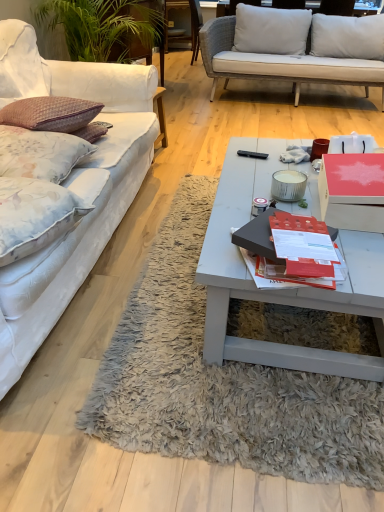
Question: Should I look upward or downward to see wooden chair at upper center?

Choices:
 (A) down
 (B) up

Answer: (B)

Question: Are matte black book at center and white fabric couch at left located far from each other?

Choices:
 (A) no
 (B) yes

Answer: (A)

Question: Is matte black book at center oriented away from white fabric couch at left?

Choices:
 (A) yes
 (B) no

Answer: (B)

Question: Considering the relative positions of matte black book at center and white fabric couch at left in the image provided, is matte black book at center to the left of white fabric couch at left from the viewer's perspective?

Choices:
 (A) yes
 (B) no

Answer: (B)

Question: Is the position of matte black book at center more distant than that of white fabric couch at left?

Choices:
 (A) no
 (B) yes

Answer: (B)

Question: Is matte black book at center shorter than white fabric couch at left?

Choices:
 (A) no
 (B) yes

Answer: (B)

Question: From the image's perspective, is matte black book at center beneath white fabric couch at left?

Choices:
 (A) yes
 (B) no

Answer: (A)

Question: Does red cardboard box at center have a greater height compared to floral fabric pillow at left, which appears as the 2th pillow when viewed from the front?

Choices:
 (A) yes
 (B) no

Answer: (B)

Question: Are red cardboard box at center and floral fabric pillow at left, the first pillow from the back, making contact?

Choices:
 (A) no
 (B) yes

Answer: (A)

Question: Can you confirm if red cardboard box at center is smaller than floral fabric pillow at left, the first pillow from the back?

Choices:
 (A) yes
 (B) no

Answer: (A)

Question: Is red cardboard box at center at the right side of floral fabric pillow at left, the first pillow from the back?

Choices:
 (A) no
 (B) yes

Answer: (B)

Question: From a real-world perspective, is red cardboard box at center beneath floral fabric pillow at left, which appears as the 2th pillow when viewed from the front?

Choices:
 (A) yes
 (B) no

Answer: (A)

Question: Is red cardboard box at center shorter than floral fabric pillow at left, the first pillow from the back?

Choices:
 (A) no
 (B) yes

Answer: (B)

Question: Does white fabric couch at left lie behind wooden chair at upper center?

Choices:
 (A) no
 (B) yes

Answer: (A)